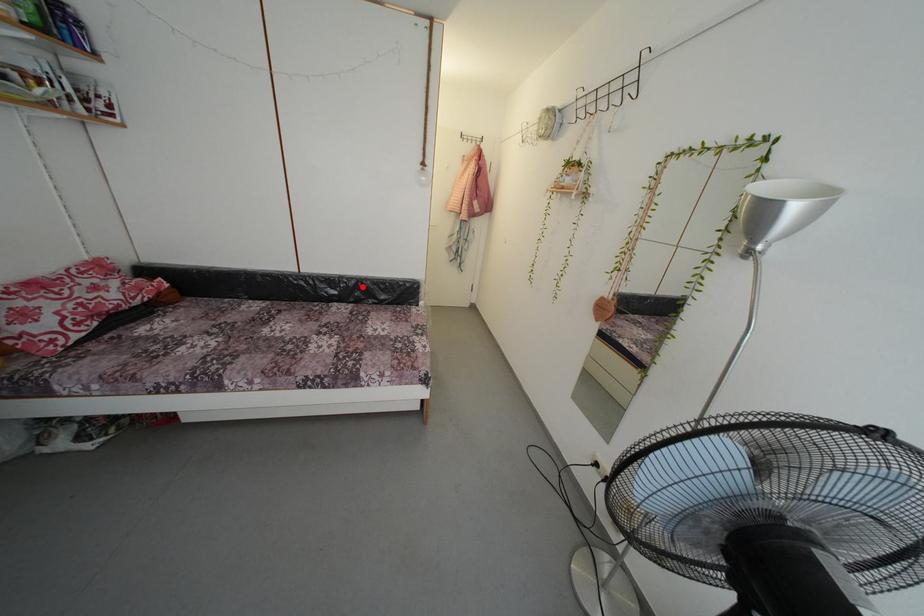
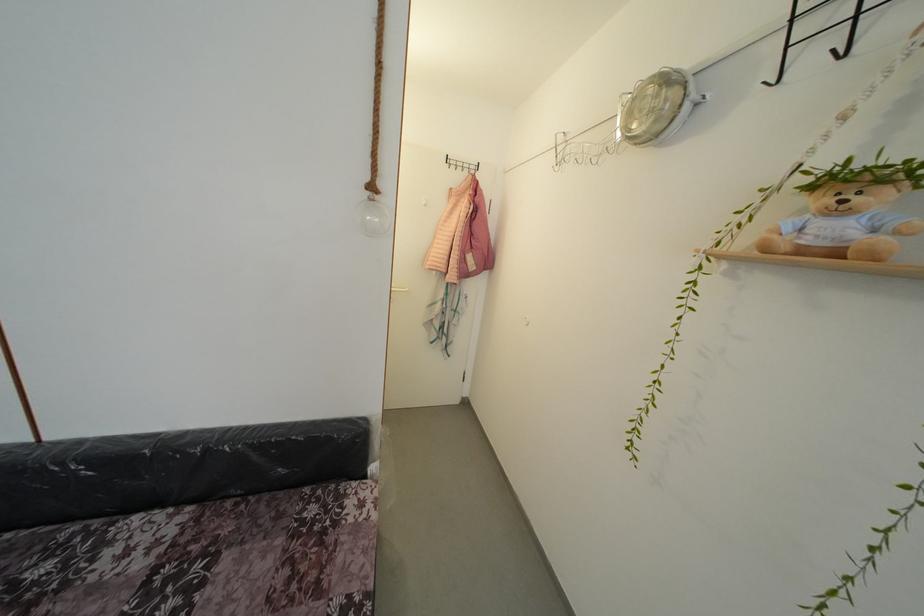
Question: I am providing you with two images of the same scene from different viewpoints. A red point is marked on the first image. At the location where the point appears in image 1, is it still visible in image 2?

Choices:
 (A) Yes
 (B) No

Answer: (A)